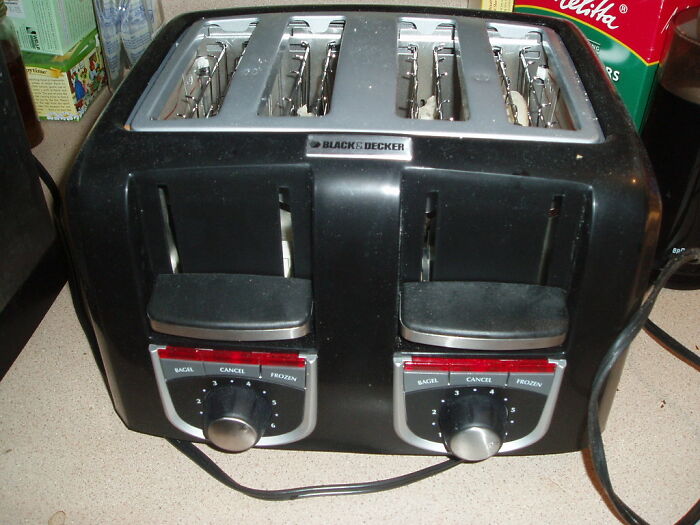
Find the location of a particular element. Image resolution: width=700 pixels, height=525 pixels. cord is located at coordinates (211, 469).